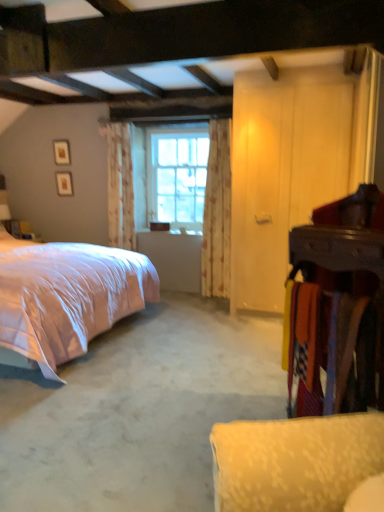
Question: Can you confirm if wooden armoire at right is bigger than white carpet at lower right?

Choices:
 (A) yes
 (B) no

Answer: (B)

Question: Could you tell me if wooden armoire at right is turned towards white carpet at lower right?

Choices:
 (A) yes
 (B) no

Answer: (B)

Question: From a real-world perspective, is wooden armoire at right positioned under white carpet at lower right based on gravity?

Choices:
 (A) no
 (B) yes

Answer: (A)

Question: Is wooden armoire at right thinner than white carpet at lower right?

Choices:
 (A) yes
 (B) no

Answer: (A)

Question: From the image's perspective, does wooden armoire at right appear higher than white carpet at lower right?

Choices:
 (A) yes
 (B) no

Answer: (A)

Question: Does wooden armoire at right have a smaller size compared to white carpet at lower right?

Choices:
 (A) no
 (B) yes

Answer: (B)

Question: Is clear glass window at center not within pink satin bed at left?

Choices:
 (A) no
 (B) yes

Answer: (B)

Question: From a real-world perspective, is clear glass window at center over pink satin bed at left?

Choices:
 (A) yes
 (B) no

Answer: (A)

Question: Considering the relative positions of clear glass window at center and pink satin bed at left in the image provided, is clear glass window at center to the right of pink satin bed at left from the viewer's perspective?

Choices:
 (A) yes
 (B) no

Answer: (A)

Question: Does clear glass window at center appear on the left side of pink satin bed at left?

Choices:
 (A) no
 (B) yes

Answer: (A)

Question: From a real-world perspective, does clear glass window at center sit lower than pink satin bed at left?

Choices:
 (A) yes
 (B) no

Answer: (B)

Question: Considering the relative sizes of clear glass window at center and pink satin bed at left in the image provided, is clear glass window at center thinner than pink satin bed at left?

Choices:
 (A) no
 (B) yes

Answer: (B)

Question: Is wooden armoire at right at the back of floral fabric curtain at center, which is counted as the 1th curtain, starting from the left?

Choices:
 (A) no
 (B) yes

Answer: (A)